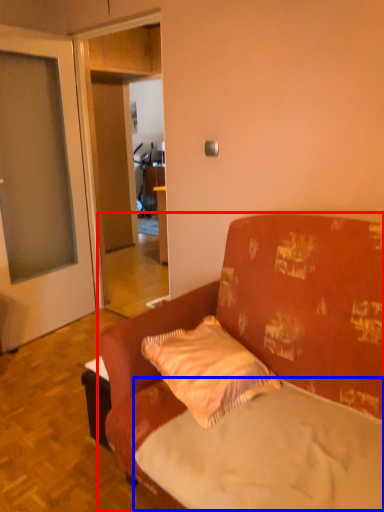
Question: Which of the following is the farthest to the observer, studio couch (highlighted by a red box) or mattress (highlighted by a blue box)?

Choices:
 (A) studio couch
 (B) mattress

Answer: (B)